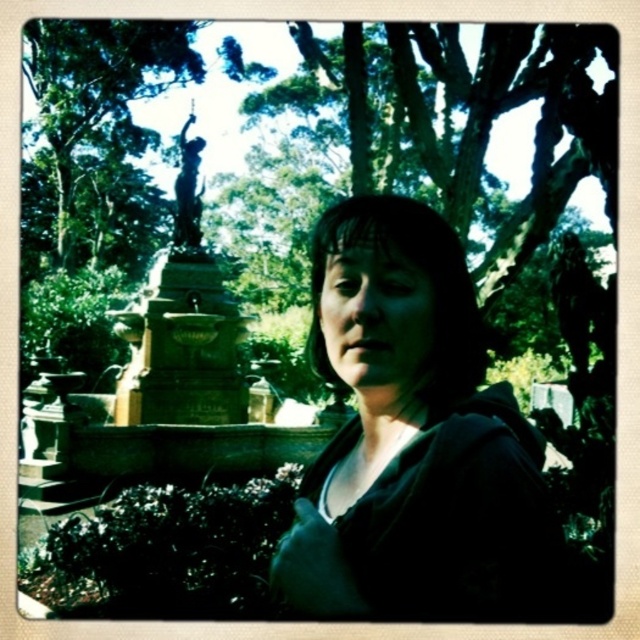
Question: Is black matte hoodie at center thinner than green leafy tree at upper left?

Choices:
 (A) yes
 (B) no

Answer: (A)

Question: Is black matte hoodie at center wider than bronze statue at upper left?

Choices:
 (A) no
 (B) yes

Answer: (B)

Question: Among these objects, which one is farthest from the camera?

Choices:
 (A) green leafy tree at upper left
 (B) matte black face at center
 (C) bronze statue at upper left
 (D) black matte hoodie at center

Answer: (C)

Question: Which of the following is the closest to the observer?

Choices:
 (A) green leafy tree at upper left
 (B) bronze statue at upper left
 (C) matte black face at center
 (D) black matte hoodie at center

Answer: (D)

Question: Which object is positioned closest to the bronze statue at upper left?

Choices:
 (A) matte black face at center
 (B) green leafy tree at upper left
 (C) black matte hoodie at center

Answer: (C)

Question: Is green leafy tree at upper left positioned at the back of bronze statue at upper left?

Choices:
 (A) yes
 (B) no

Answer: (B)